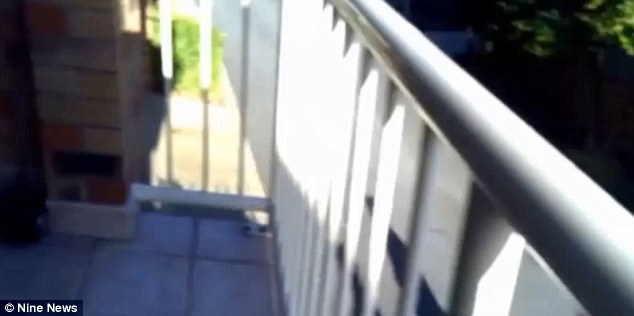
Locate an element on the screen. The image size is (634, 316). bottom rail is located at coordinates (193, 197).